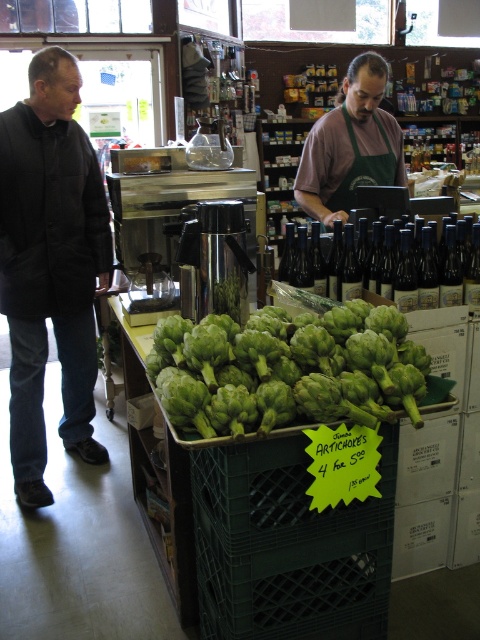
You are a customer in the grocery store and want to know which is taller between the green matte artichoke at center and the green apron at center. Can you determine which one is taller?

The green matte artichoke at center is not as tall as the green apron at center, so the green apron at center is taller.

From the picture: You are standing in the grocery store and want to buy the green matte artichoke at center. The store has a rule that you must pick items from the counter closest to you. The counter with the green matte artichoke at center is located at point (285, 371). Is this the closest counter to you?

A: The green matte artichoke at center is represented by point (285, 371), so the counter it is on is at that location. Since the question asks if this is the closest counter to you, but there is no information about other counters or their distances provided, it cannot be determined from the given information.